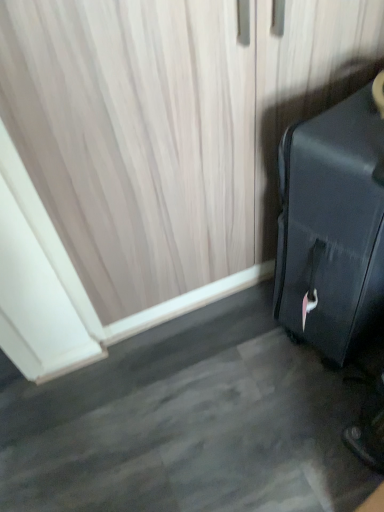
What do you see at coordinates (135, 139) in the screenshot?
I see `matte beige curtain at upper left` at bounding box center [135, 139].

At what (x,y) coordinates should I click in order to perform the action: click on matte beige curtain at upper left. Please return your answer as a coordinate pair (x, y). Looking at the image, I should click on (135, 139).

Measure the distance between point (22, 146) and camera.

Point (22, 146) is 91.40 centimeters from camera.

I want to click on black matte suitcase at right, so click(x=333, y=225).

What is the approximate width of black matte suitcase at right?

It is 13.57 inches.

Describe the element at coordinates (333, 225) in the screenshot. I see `black matte suitcase at right` at that location.

You are a GUI agent. You are given a task and a screenshot of the screen. Output one action in this format:
    pyautogui.click(x=<x>, y=<y>)
    Task: Click on the matte beige curtain at upper left
    
    Given the screenshot: What is the action you would take?
    click(x=135, y=139)

Is matte beige curtain at upper left to the right of black matte suitcase at right from the viewer's perspective?

In fact, matte beige curtain at upper left is to the left of black matte suitcase at right.

Is matte beige curtain at upper left positioned in front of black matte suitcase at right?

That is False.

Which is closer to the camera, (251, 170) or (281, 261)?

Point (251, 170).

From the image's perspective, which is below, matte beige curtain at upper left or black matte suitcase at right?

black matte suitcase at right appears lower in the image.

From a real-world perspective, is matte beige curtain at upper left physically located above or below black matte suitcase at right?

In terms of real-world spatial position, matte beige curtain at upper left is above black matte suitcase at right.

Which object is wider, matte beige curtain at upper left or black matte suitcase at right?

black matte suitcase at right is wider.

Does matte beige curtain at upper left have a lesser height compared to black matte suitcase at right?

Incorrect, the height of matte beige curtain at upper left does not fall short of that of black matte suitcase at right.

Based on the photo, which of these two, matte beige curtain at upper left or black matte suitcase at right, is bigger?

Bigger between the two is black matte suitcase at right.

Is matte beige curtain at upper left spatially inside black matte suitcase at right, or outside of it?

matte beige curtain at upper left is located beyond the bounds of black matte suitcase at right.

Is matte beige curtain at upper left positioned far away from black matte suitcase at right?

No, there isn't a large distance between matte beige curtain at upper left and black matte suitcase at right.

Is black matte suitcase at right at the back of matte beige curtain at upper left?

Correct, matte beige curtain at upper left is looking away from black matte suitcase at right.

Image resolution: width=384 pixels, height=512 pixels. I want to click on suitcase below the matte beige curtain at upper left (from a real-world perspective), so click(x=333, y=225).

Considering the positions of objects black matte suitcase at right and matte beige curtain at upper left in the image provided, who is more to the left, black matte suitcase at right or matte beige curtain at upper left?

Positioned to the left is matte beige curtain at upper left.

Between black matte suitcase at right and matte beige curtain at upper left, which one is positioned in front?

black matte suitcase at right is closer to the camera.

Does point (342, 252) appear closer or farther from the camera than point (148, 56)?

Point (342, 252) is positioned farther from the camera compared to point (148, 56).

From the image's perspective, is black matte suitcase at right on matte beige curtain at upper left?

Actually, black matte suitcase at right appears below matte beige curtain at upper left in the image.

From a real-world perspective, is black matte suitcase at right positioned above or below matte beige curtain at upper left?

In terms of real-world spatial position, black matte suitcase at right is below matte beige curtain at upper left.

Can you confirm if black matte suitcase at right is thinner than matte beige curtain at upper left?

In fact, black matte suitcase at right might be wider than matte beige curtain at upper left.

In terms of height, does black matte suitcase at right look taller or shorter compared to matte beige curtain at upper left?

Clearly, black matte suitcase at right is shorter compared to matte beige curtain at upper left.

Is black matte suitcase at right smaller than matte beige curtain at upper left?

Actually, black matte suitcase at right might be larger than matte beige curtain at upper left.

Is matte beige curtain at upper left a part of black matte suitcase at right?

No, matte beige curtain at upper left is not inside black matte suitcase at right.

Consider the image. Does black matte suitcase at right touch matte beige curtain at upper left?

No, black matte suitcase at right is not touching matte beige curtain at upper left.

Consider the image. Could you tell me if black matte suitcase at right is turned towards matte beige curtain at upper left?

No, black matte suitcase at right is not oriented towards matte beige curtain at upper left.

Based on the photo, how different are the orientations of black matte suitcase at right and matte beige curtain at upper left in degrees?

The angle between the facing direction of black matte suitcase at right and the facing direction of matte beige curtain at upper left is 19.2 degrees.

Find the location of a particular element. The height and width of the screenshot is (512, 384). curtain lying on the left of black matte suitcase at right is located at coordinates (135, 139).

Find the location of a particular element. curtain that is behind the black matte suitcase at right is located at coordinates (135, 139).

Where is `suitcase below the matte beige curtain at upper left (from a real-world perspective)`? The width and height of the screenshot is (384, 512). suitcase below the matte beige curtain at upper left (from a real-world perspective) is located at coordinates (333, 225).